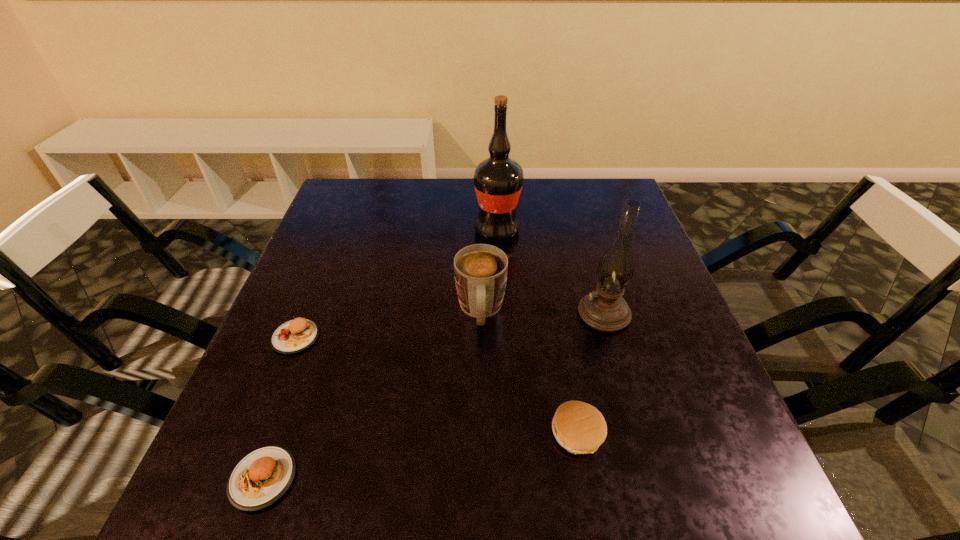
Image resolution: width=960 pixels, height=540 pixels. In order to click on vacant space situated 0.160m on the side of the third tallest object with the handle in this screenshot , I will do `click(481, 407)`.

Where is `vacant space situated 0.100m on the front of the farthest food`? vacant space situated 0.100m on the front of the farthest food is located at coordinates (271, 399).

You are a GUI agent. You are given a task and a screenshot of the screen. Output one action in this format:
    pyautogui.click(x=<x>, y=<y>)
    Task: Click on the vacant space positioned on the back of the fifth object from left to right
    This screenshot has width=960, height=540.
    Given the screenshot: What is the action you would take?
    pyautogui.click(x=556, y=307)

At what (x,y) coordinates should I click in order to perform the action: click on vacant space located on the right of the shortest food. Please return your answer as a coordinate pair (x, y). Looking at the image, I should click on (389, 478).

Find the location of a particular element. object positioned at the far edge is located at coordinates click(x=498, y=180).

Identify the location of object located at the near edge. This screenshot has height=540, width=960. (259, 479).

Locate an element on the screen. The width and height of the screenshot is (960, 540). object that is at the right edge is located at coordinates (615, 270).

Find the location of a particular element. object at the near left corner is located at coordinates (259, 479).

Locate an element on the screen. The height and width of the screenshot is (540, 960). vacant space at the far edge of the desktop is located at coordinates (529, 188).

In the image, there is a desktop. Identify the location of vacant area at the near edge. Image resolution: width=960 pixels, height=540 pixels. (300, 517).